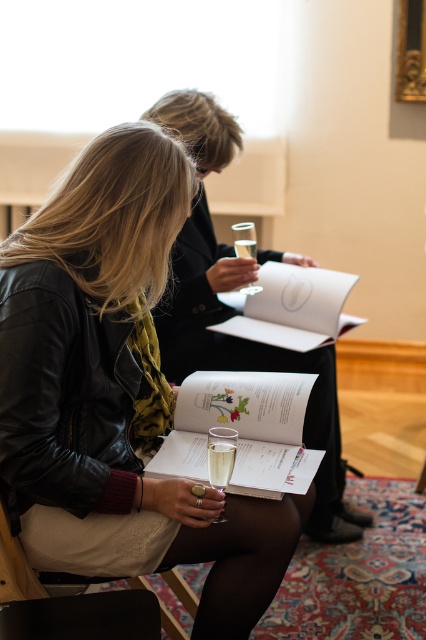
You are a photographer trying to capture a clear shot of the translucent glass at lower center. However, the leather jacket at center is blocking your view. Can you move the jacket to get a better angle?

The leather jacket at center is positioned over the translucent glass at lower center, so moving the jacket would allow you to see the glass clearly.

You are standing in the room and want to reach the point marked at coordinates (221, 477). If you take a step forward of 1 meter, will you be closer to the point?

The point at coordinates (221, 477) is 1.51 meters away from the viewer. Taking a step forward of 1 meter would bring you to 0.51 meters away from the point, so yes, you will be closer.

Consider the image. You are at a party and want to choose a glass for your champagne. You prefer a taller glass to make the drink appear more elegant. Which one between the clear glass wine glass at lower center and the translucent glass at lower center should you pick?

The clear glass wine glass at lower center is taller than the translucent glass at lower center, so you should choose the clear glass wine glass at lower center to make the champagne appear more elegant.